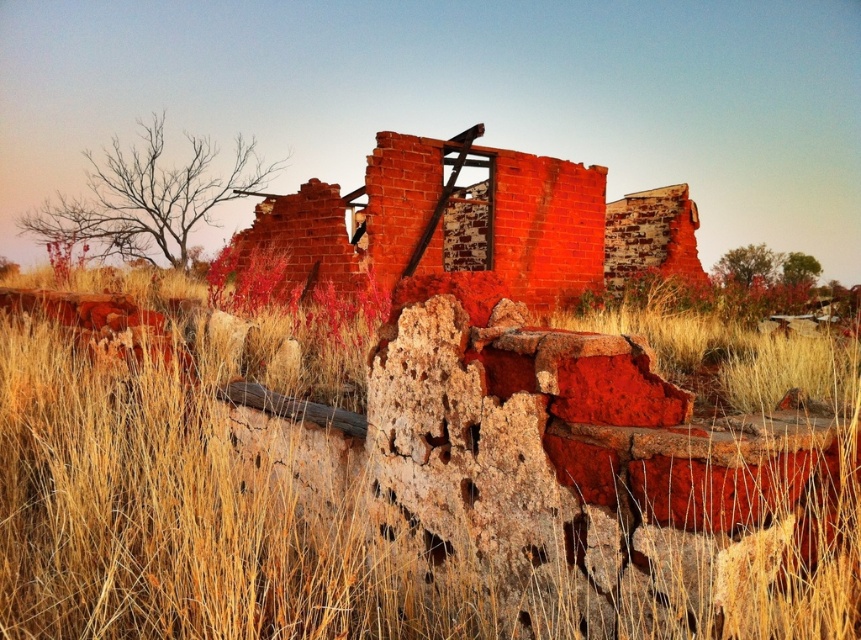
Question: Can you confirm if dry grass at center is wider than brick wall at center?

Choices:
 (A) yes
 (B) no

Answer: (B)

Question: Is dry grass at center in front of brick wall at center?

Choices:
 (A) no
 (B) yes

Answer: (B)

Question: Is the position of dry grass at center more distant than that of brick wall at center?

Choices:
 (A) no
 (B) yes

Answer: (A)

Question: Which of the following is the farthest from the observer?

Choices:
 (A) (425, 221)
 (B) (841, 467)

Answer: (A)